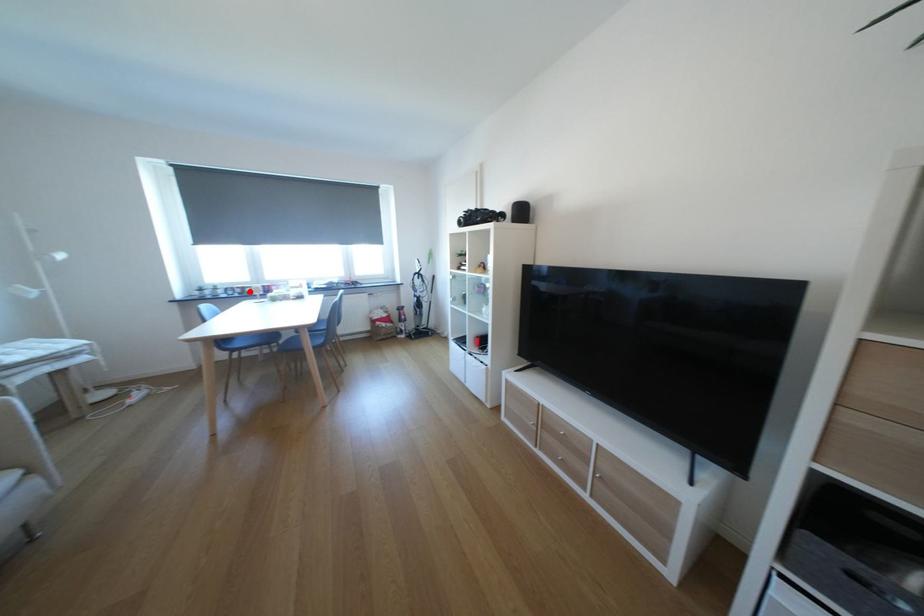
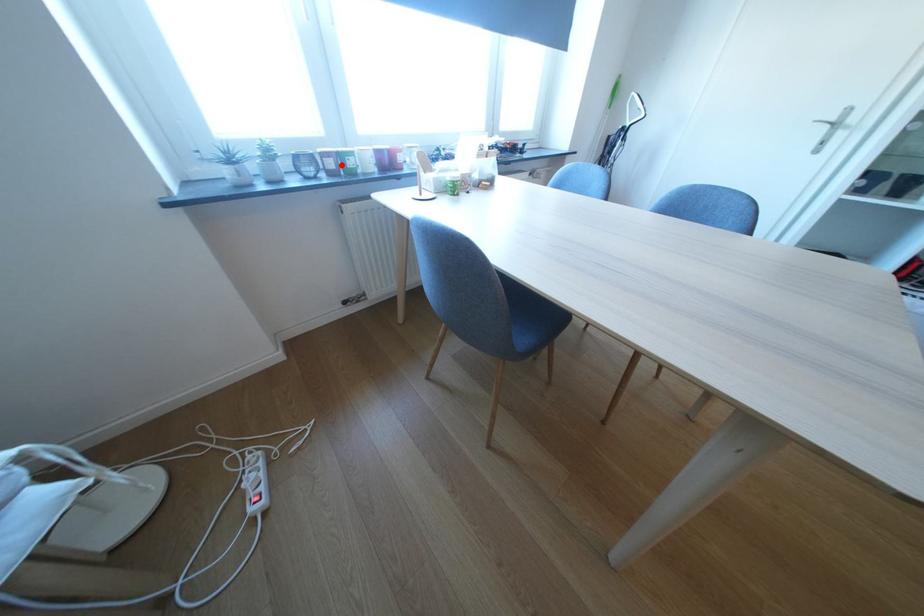
Consider the image. I am providing you with two images of the same scene from different viewpoints. A red point is marked on the first image and another point is marked on the second image. Is the red point in image1 aligned with the point shown in image2?

Yes